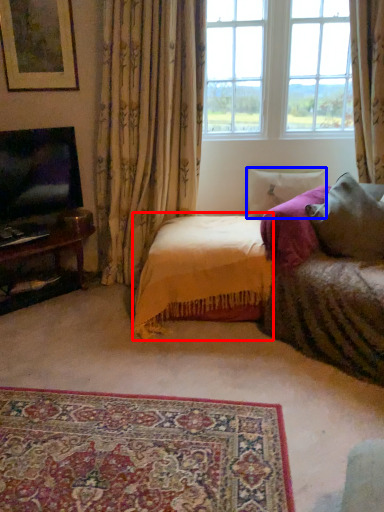
Question: Which point is further to the camera, bedding (highlighted by a red box) or pillow (highlighted by a blue box)?

Choices:
 (A) bedding
 (B) pillow

Answer: (B)